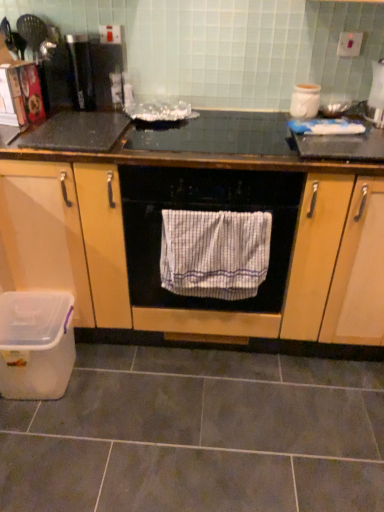
What is the approximate width of white striped towel at center?

25.85 inches.

This screenshot has width=384, height=512. I want to click on white glossy kettle at upper right, which appears as the 2th appliance when viewed from the left, so click(376, 95).

Describe the element at coordinates (197, 209) in the screenshot. Image resolution: width=384 pixels, height=512 pixels. I see `wooden cabinet at center` at that location.

Find the location of a particular element. The width and height of the screenshot is (384, 512). white glossy jar at upper right, which is counted as the first appliance, starting from the left is located at coordinates (305, 101).

Are white glossy jar at upper right, which appears as the 2th appliance when viewed from the right, and gray matte tile at lower center making contact?

No, white glossy jar at upper right, which appears as the 2th appliance when viewed from the right, is not next to gray matte tile at lower center.

From a real-world perspective, between white glossy jar at upper right, which appears as the 2th appliance when viewed from the right, and gray matte tile at lower center, who is vertically lower?

gray matte tile at lower center.

I want to click on ceramic tile on the left of white glossy jar at upper right, which is counted as the first appliance, starting from the left, so click(198, 435).

From a real-world perspective, is wooden cabinet at center located higher than white glossy jar at upper right, which is counted as the first appliance, starting from the left?

No, from a real-world perspective, wooden cabinet at center is not above white glossy jar at upper right, which is counted as the first appliance, starting from the left.

From the picture: Is white glossy jar at upper right, which is counted as the first appliance, starting from the left, a part of wooden cabinet at center?

No, wooden cabinet at center does not contain white glossy jar at upper right, which is counted as the first appliance, starting from the left.

From the image's perspective, would you say wooden cabinet at center is positioned over white glossy jar at upper right, which is counted as the first appliance, starting from the left?

Incorrect, from the image's perspective, wooden cabinet at center is lower than white glossy jar at upper right, which is counted as the first appliance, starting from the left.

Which object is positioned more to the left, wooden cabinet at center or white glossy jar at upper right, which appears as the 2th appliance when viewed from the right?

From the viewer's perspective, wooden cabinet at center appears more on the left side.

Does wooden cabinet at center have a lesser height compared to transparent plastic container at lower left?

No.

Considering the positions of objects wooden cabinet at center and transparent plastic container at lower left in the image provided, who is more to the left, wooden cabinet at center or transparent plastic container at lower left?

Positioned to the left is transparent plastic container at lower left.

Between wooden cabinet at center and transparent plastic container at lower left, which one has smaller width?

Thinner between the two is transparent plastic container at lower left.

What's the angular difference between white glossy kettle at upper right, which appears as the 2th appliance when viewed from the left, and white glossy jar at upper right, which appears as the 2th appliance when viewed from the right,'s facing directions?

The angular difference between white glossy kettle at upper right, which appears as the 2th appliance when viewed from the left, and white glossy jar at upper right, which appears as the 2th appliance when viewed from the right, is 3.25 degrees.

Considering the relative positions of white glossy kettle at upper right, which appears as the 2th appliance when viewed from the left, and white glossy jar at upper right, which is counted as the first appliance, starting from the left, in the image provided, is white glossy kettle at upper right, which appears as the 2th appliance when viewed from the left, to the right of white glossy jar at upper right, which is counted as the first appliance, starting from the left, from the viewer's perspective?

Yes, white glossy kettle at upper right, which appears as the 2th appliance when viewed from the left, is to the right of white glossy jar at upper right, which is counted as the first appliance, starting from the left.

Is point (381, 88) positioned behind point (313, 115)?

That is True.

Measure the distance from white glossy kettle at upper right, which appears as the first appliance when viewed from the right, to white glossy jar at upper right, which is counted as the first appliance, starting from the left.

white glossy kettle at upper right, which appears as the first appliance when viewed from the right, is 10.19 inches from white glossy jar at upper right, which is counted as the first appliance, starting from the left.

Between white striped towel at center and white glossy kettle at upper right, which appears as the 2th appliance when viewed from the left, which one appears on the left side from the viewer's perspective?

white striped towel at center is more to the left.

From the white striped towel at center, count 1st appliances backward and point to it. Please provide its 2D coordinates.

[(376, 95)]

Is white striped towel at center oriented away from white glossy kettle at upper right, which appears as the first appliance when viewed from the right?

No.

Can you tell me how much white striped towel at center and white glossy kettle at upper right, which appears as the 2th appliance when viewed from the left, differ in facing direction?

There is a 1.17-degree angle between the facing directions of white striped towel at center and white glossy kettle at upper right, which appears as the 2th appliance when viewed from the left.

In the scene shown: Can you confirm if gray matte tile at lower center is smaller than transparent plastic container at lower left?

No.

Considering the relative positions of gray matte tile at lower center and transparent plastic container at lower left in the image provided, is gray matte tile at lower center to the right of transparent plastic container at lower left from the viewer's perspective?

Yes.

From the picture: Which of these two, gray matte tile at lower center or transparent plastic container at lower left, is wider?

gray matte tile at lower center.

Which point is more distant from viewer, [156,296] or [300,117]?

Positioned behind is point [156,296].

Is white striped towel at center outside of white glossy jar at upper right, which appears as the 2th appliance when viewed from the right?

white striped towel at center is positioned outside white glossy jar at upper right, which appears as the 2th appliance when viewed from the right.

There is a white striped towel at center. Identify the location of the 1st appliance above it (from the image's perspective). This screenshot has width=384, height=512. (305, 101).

Is white striped towel at center not near white glossy jar at upper right, which appears as the 2th appliance when viewed from the right?

No, white striped towel at center is in close proximity to white glossy jar at upper right, which appears as the 2th appliance when viewed from the right.

Identify the location of the 1st appliance above when counting from the gray matte tile at lower center (from the image's perspective). (305, 101).

The height and width of the screenshot is (512, 384). Find the location of `the 1st appliance located above the wooden cabinet at center (from a real-world perspective)`. the 1st appliance located above the wooden cabinet at center (from a real-world perspective) is located at coordinates (305, 101).

Estimate the real-world distances between objects in this image. Which object is further from white striped towel at center, wooden cabinet at center or transparent plastic container at lower left?

Based on the image, transparent plastic container at lower left appears to be further to white striped towel at center.

Looking at the image, which one is located closer to white glossy jar at upper right, which appears as the 2th appliance when viewed from the right, white striped towel at center or gray matte tile at lower center?

white striped towel at center.

When comparing their distances from wooden cabinet at center, does gray matte tile at lower center or white striped towel at center seem further?

gray matte tile at lower center is positioned further to the anchor wooden cabinet at center.

When comparing their distances from wooden cabinet at center, does gray matte tile at lower center or white striped towel at center seem closer?

The object closer to wooden cabinet at center is white striped towel at center.

Considering their positions, is white glossy jar at upper right, which appears as the 2th appliance when viewed from the right, positioned further to gray matte tile at lower center than white striped towel at center?

Based on the image, white glossy jar at upper right, which appears as the 2th appliance when viewed from the right, appears to be further to gray matte tile at lower center.

Considering their positions, is white glossy kettle at upper right, which appears as the 2th appliance when viewed from the left, positioned closer to gray matte tile at lower center than white striped towel at center?

Among the two, white striped towel at center is located nearer to gray matte tile at lower center.

Estimate the real-world distances between objects in this image. Which object is closer to white glossy kettle at upper right, which appears as the 2th appliance when viewed from the left, white glossy jar at upper right, which appears as the 2th appliance when viewed from the right, or transparent plastic container at lower left?

white glossy jar at upper right, which appears as the 2th appliance when viewed from the right, is closer to white glossy kettle at upper right, which appears as the 2th appliance when viewed from the left.

Based on their spatial positions, is white striped towel at center or wooden cabinet at center closer to transparent plastic container at lower left?

wooden cabinet at center lies closer to transparent plastic container at lower left than the other object.

Where is `cabinetry located between transparent plastic container at lower left and white glossy jar at upper right, which appears as the 2th appliance when viewed from the right, in the left-right direction`? This screenshot has width=384, height=512. cabinetry located between transparent plastic container at lower left and white glossy jar at upper right, which appears as the 2th appliance when viewed from the right, in the left-right direction is located at coordinates (197, 209).

Locate an element on the screen. bath towel between transparent plastic container at lower left and wooden cabinet at center in the horizontal direction is located at coordinates (214, 253).

Locate an element on the screen. Image resolution: width=384 pixels, height=512 pixels. bath towel between white striped towel at center and gray matte tile at lower center vertically is located at coordinates (214, 253).

You are a GUI agent. You are given a task and a screenshot of the screen. Output one action in this format:
    pyautogui.click(x=<x>, y=<y>)
    Task: Click on the home appliance located between transparent plastic container at lower left and white striped towel at center in the left-right direction
    Image resolution: width=384 pixels, height=512 pixels.
    Given the screenshot: What is the action you would take?
    pyautogui.click(x=204, y=210)